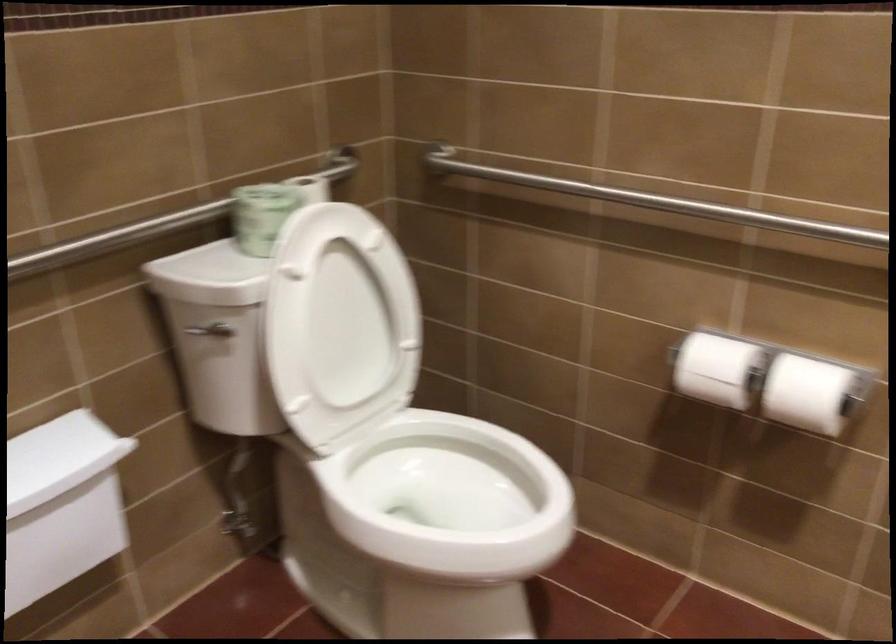
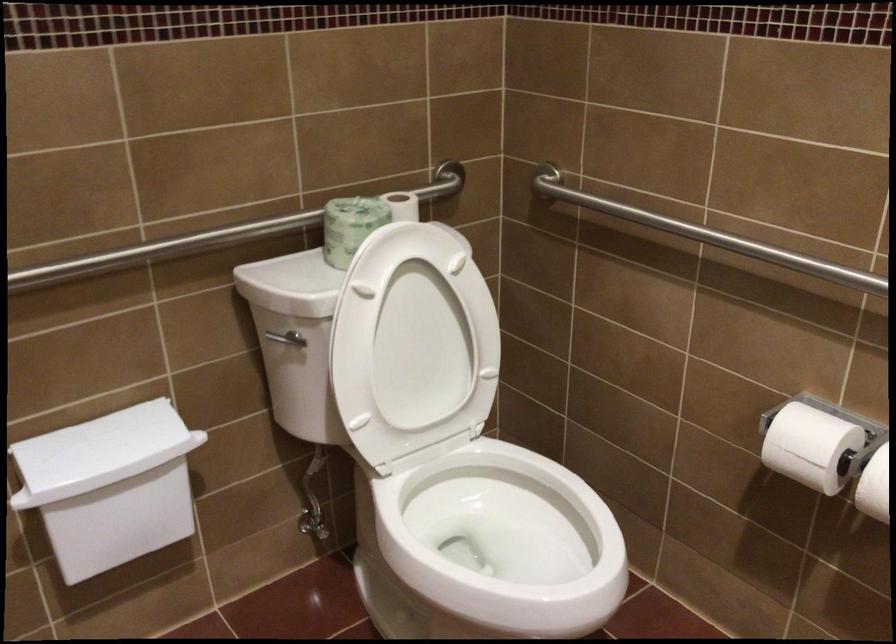
The point at (606, 193) is marked in the first image. Where is the corresponding point in the second image?

(709, 236)